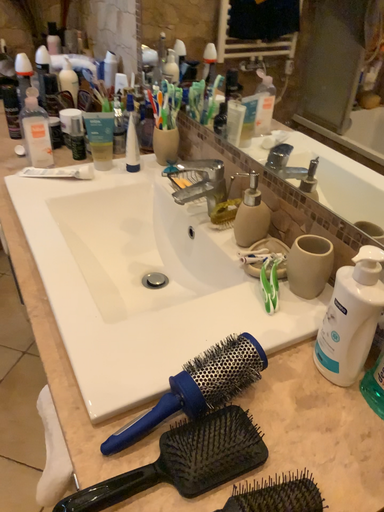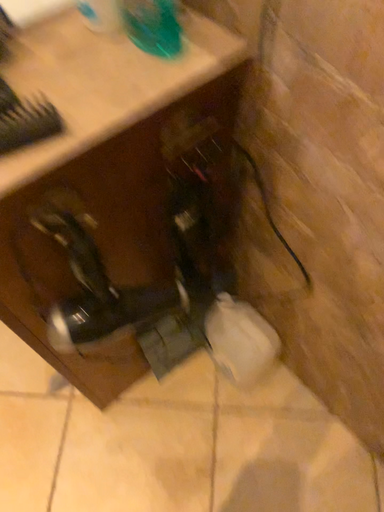
Question: Which way did the camera rotate in the video?

Choices:
 (A) rotated upward
 (B) rotated downward

Answer: (B)